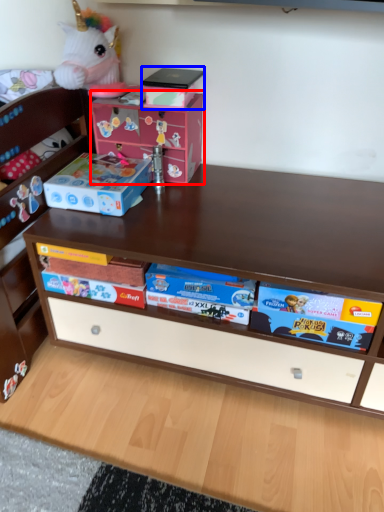
Question: Which object appears closest to the camera in this image, cardboard box (highlighted by a red box) or box (highlighted by a blue box)?

Choices:
 (A) cardboard box
 (B) box

Answer: (B)